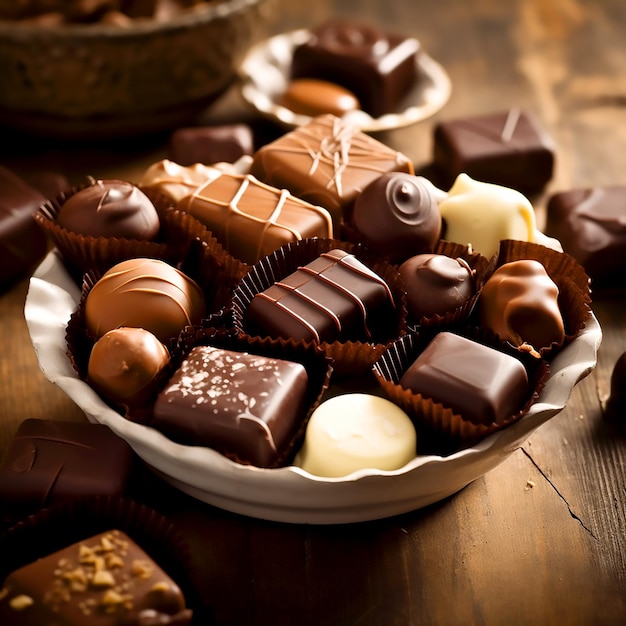
The image size is (626, 626). What are the coordinates of `chocolates in bronze bowl` in the screenshot? It's located at (103, 19).